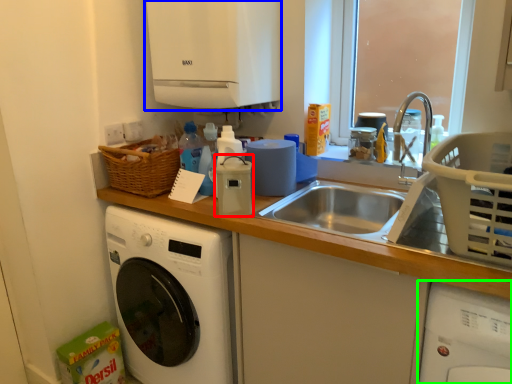
Question: Based on their relative distances, which object is nearer to appliance (highlighted by a red box)? Choose from appliance (highlighted by a blue box) and washing machine (highlighted by a green box).

Choices:
 (A) appliance
 (B) washing machine

Answer: (A)